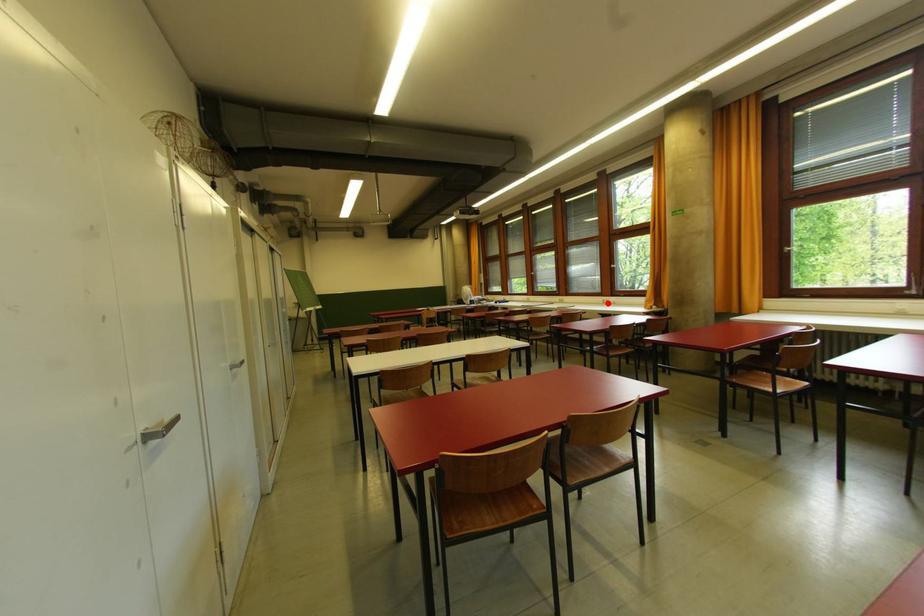
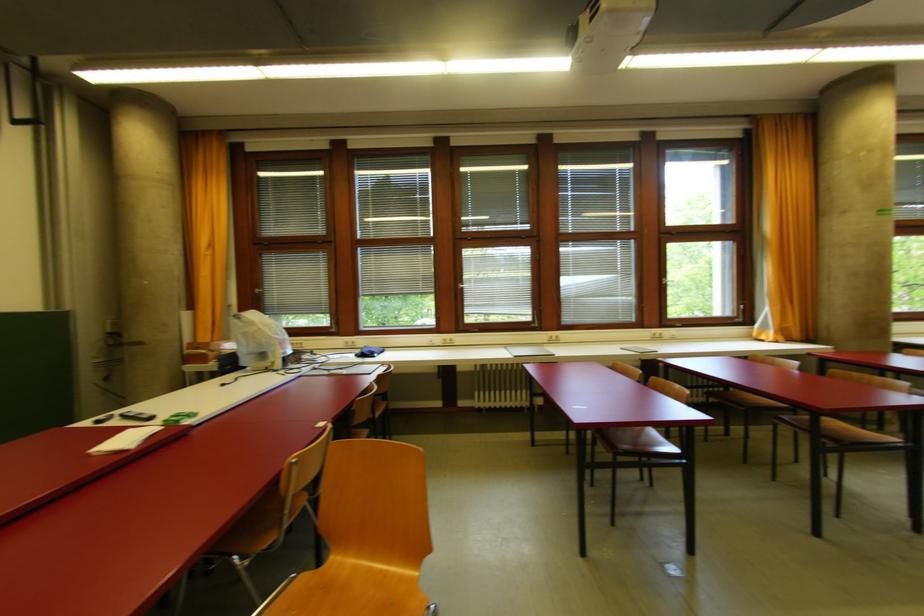
Where in the second image is the point corresponding to the highlighted location from the first image?

(660, 338)